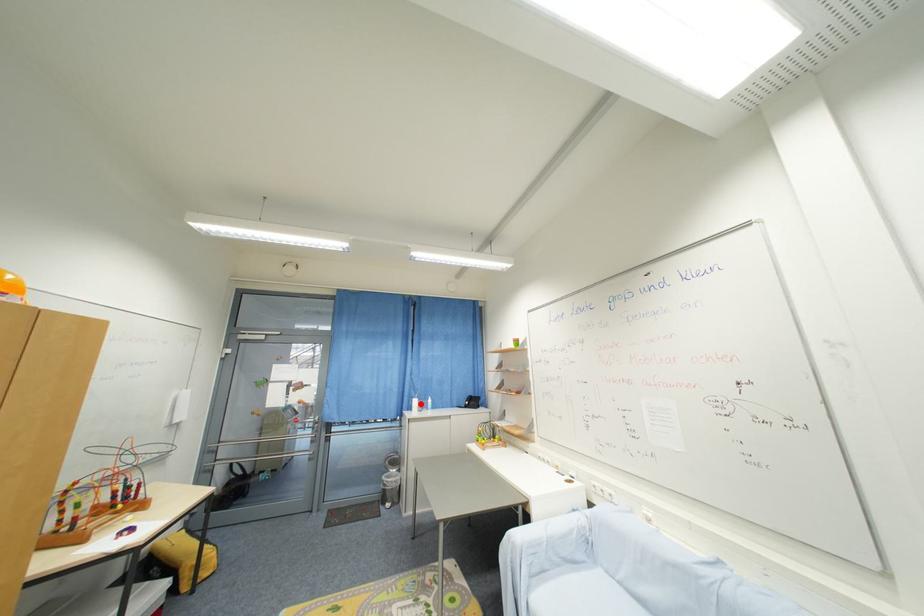
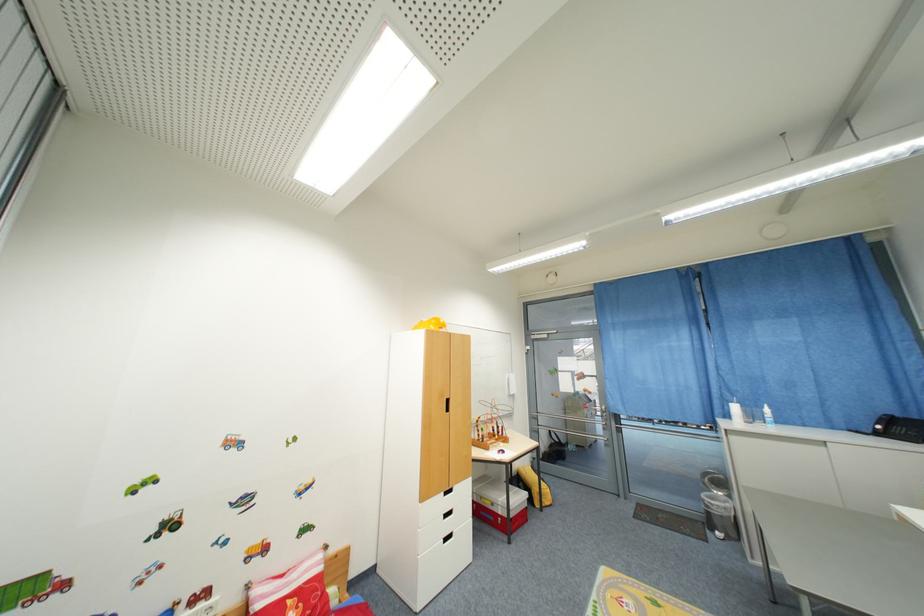
In the second image, find the point that corresponds to the highlighted location in the first image.

(740, 410)